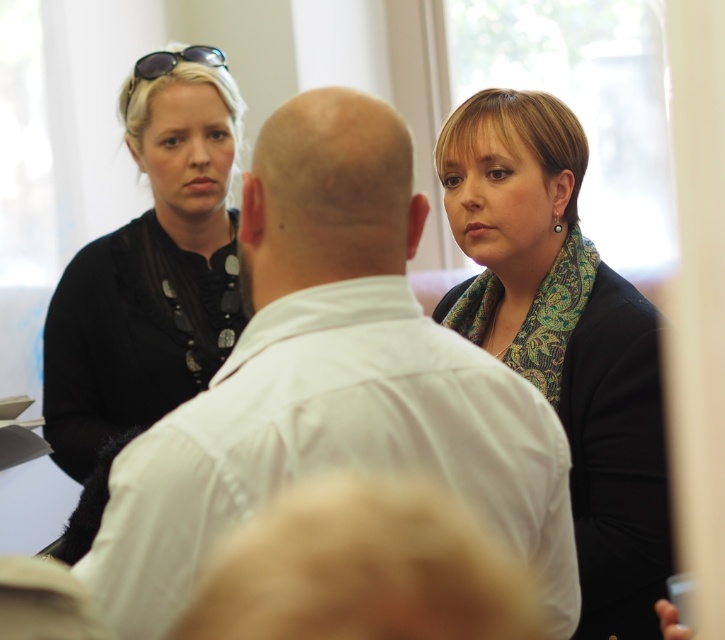
From the picture: Is dark green textured scarf at right bigger than sunglasses at upper left?

Correct, dark green textured scarf at right is larger in size than sunglasses at upper left.

Can you confirm if dark green textured scarf at right is thinner than sunglasses at upper left?

Incorrect, dark green textured scarf at right's width is not less than sunglasses at upper left's.

Identify the location of dark green textured scarf at right. The height and width of the screenshot is (640, 725). (563, 337).

Where is `dark green textured scarf at right`? dark green textured scarf at right is located at coordinates (563, 337).

Is white matte shirt at center smaller than sunglasses at upper left?

Actually, white matte shirt at center might be larger than sunglasses at upper left.

Between point (218, 376) and point (149, 64), which one is positioned in front?

Point (218, 376) is more forward.

Image resolution: width=725 pixels, height=640 pixels. What are the coordinates of `white matte shirt at center` in the screenshot? It's located at (331, 380).

Is dark green textured scarf at right shorter than black matte shirt at upper left?

Yes, dark green textured scarf at right is shorter than black matte shirt at upper left.

Does dark green textured scarf at right appear on the left side of black matte shirt at upper left?

Incorrect, dark green textured scarf at right is not on the left side of black matte shirt at upper left.

Between point (589, 266) and point (154, 280), which one is positioned behind?

Positioned behind is point (154, 280).

Locate an element on the screen. The width and height of the screenshot is (725, 640). dark green textured scarf at right is located at coordinates (563, 337).